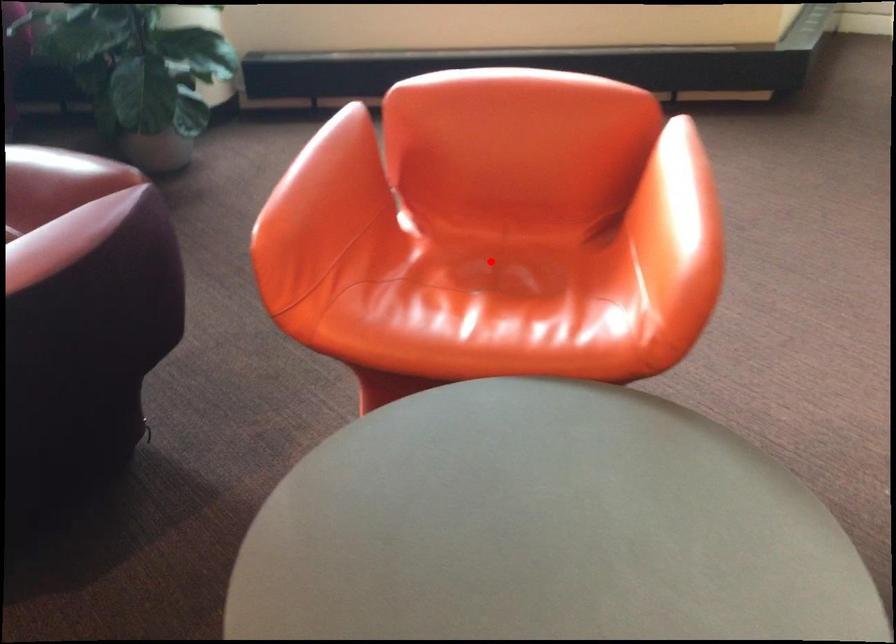
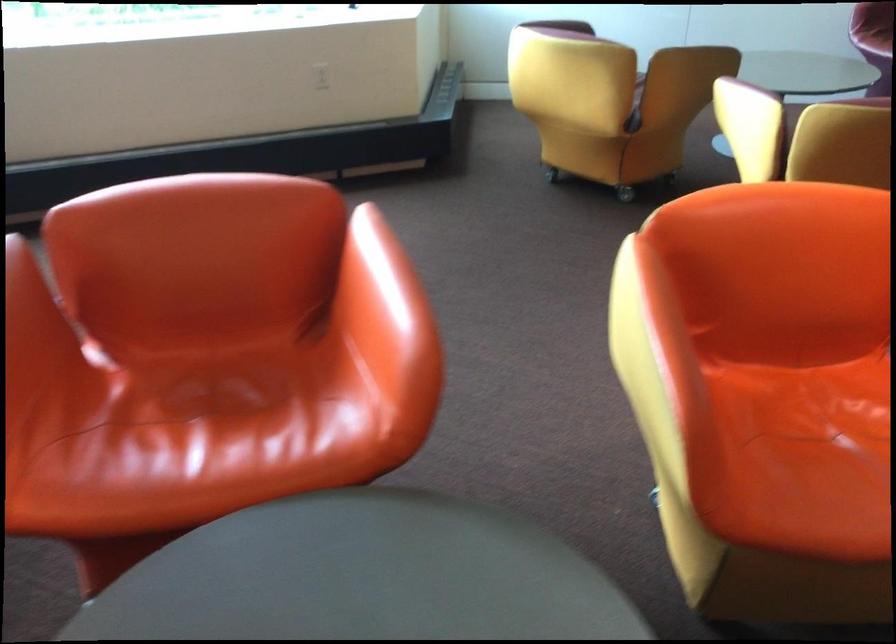
Find the pixel in the second image that matches the highlighted location in the first image.

(208, 384)